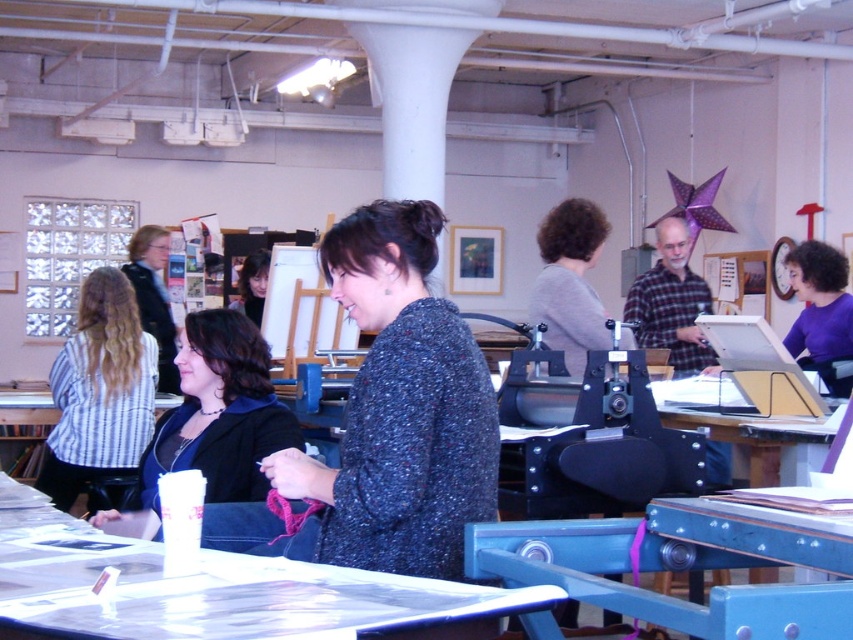
You are a photographer standing at the camera position. You want to take a closeup photo of the speckled wool sweater at center. Can you reach it without moving your feet?

The speckled wool sweater at center is 5.64 feet away from camera, so yes, you can reach it without moving your feet since 5.64 feet is a manageable distance for a photographer to capture a closeup.

You are standing at the entrance of the room and want to walk towards the point at coordinates point (409, 362) and point (822, 349). Which point should you aim for first if you want to reach the one closer to you?

Point (409, 362) is closer to you than point (822, 349), so you should aim for point (409, 362) first.

You are standing in the industrial room and want to place a small vase on the white glossy table at lower center. The gray sweater at center is currently occupying some space. Is the table still accessible for placing the vase?

The white glossy table at lower center is to the left of the gray sweater at center, so the table is accessible for placing the vase as long as there is space on its left side not blocked by the sweater.